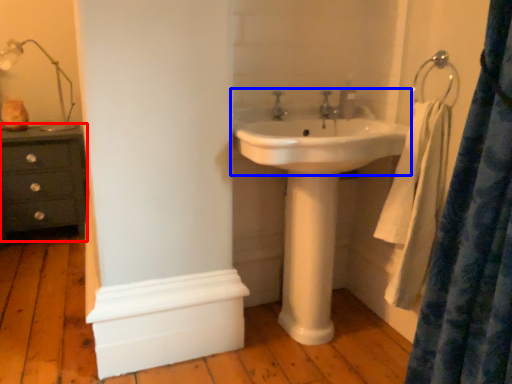
Question: Which of the following is the closest to the observer, chest of drawers (highlighted by a red box) or sink (highlighted by a blue box)?

Choices:
 (A) chest of drawers
 (B) sink

Answer: (B)